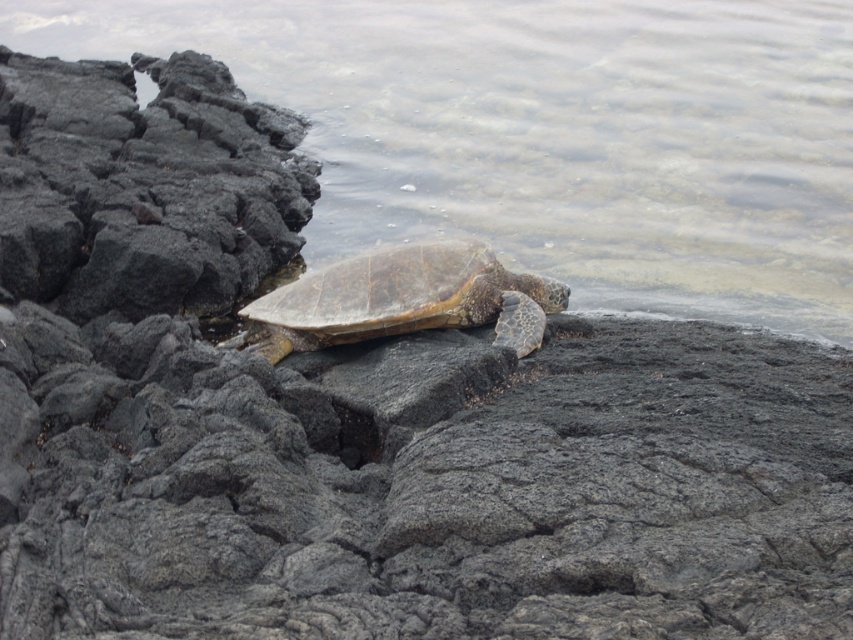
From the picture: Who is taller, clear water at upper center or brown textured shell at center?

clear water at upper center is taller.

Is clear water at upper center above brown textured shell at center?

Yes.

Who is more forward, (90,13) or (428,273)?

Positioned in front is point (428,273).

Find the location of `clear water at upper center`. clear water at upper center is located at coordinates (550, 134).